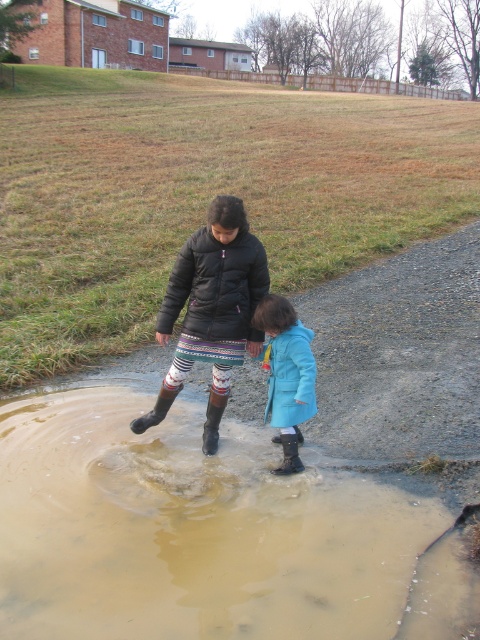
You are standing in front of the two jackets, black fuzzy jacket at center and black puffy jacket at center, in the image. Which jacket is nearer to you?

The black fuzzy jacket at center is closer to the viewer than the black puffy jacket at center.

You are designing a new fashion collection and want to incorporate the matte blue coat at lower center and the brown rubber boot at lower center into an outfit. Which item should you choose if you want the larger piece to dominate the visual focus?

The matte blue coat at lower center is larger in size than the brown rubber boot at lower center, so choosing the matte blue coat at lower center will ensure the larger piece dominates the visual focus.

In the scene shown: You are a fashion designer observing two jackets in the image. The black fuzzy jacket at center and the black puffy jacket at center. Which one is bigger in size?

The black fuzzy jacket at center is larger in size compared to the black puffy jacket at center.